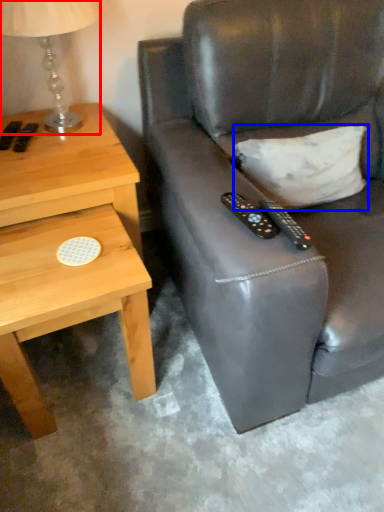
Question: Which point is closer to the camera, table lamp (highlighted by a red box) or pillow (highlighted by a blue box)?

Choices:
 (A) table lamp
 (B) pillow

Answer: (A)